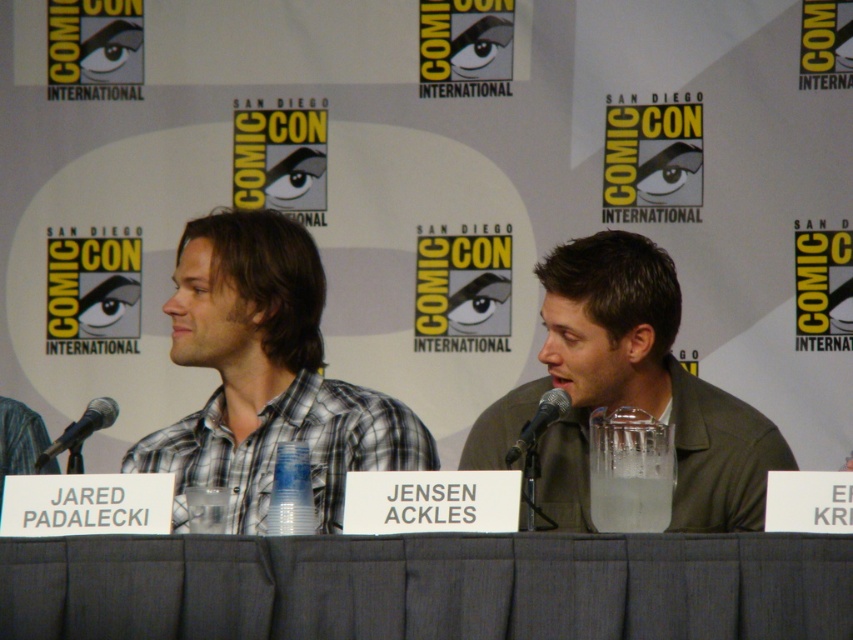
Does green matte jacket at center have a greater width compared to black metallic microphone at left?

Yes, green matte jacket at center is wider than black metallic microphone at left.

Which is below, green matte jacket at center or black metallic microphone at left?

black metallic microphone at left is below.

In order to click on green matte jacket at center in this screenshot , I will do `click(630, 392)`.

Between gray fabric table at center and green matte jacket at center, which one has less height?

gray fabric table at center

Between point (108, 554) and point (677, 496), which one is positioned in front?

Point (108, 554) is in front.

Is point (41, 579) less distant than point (614, 314)?

Yes.

Identify the location of gray fabric table at center. (427, 586).

Which is above, plaid cotton shirt at center or black metallic microphone at left?

plaid cotton shirt at center

Does plaid cotton shirt at center have a greater width compared to black metallic microphone at left?

Correct, the width of plaid cotton shirt at center exceeds that of black metallic microphone at left.

Is point (381, 436) in front of point (74, 442)?

No, it is behind (74, 442).

The height and width of the screenshot is (640, 853). I want to click on plaid cotton shirt at center, so click(267, 374).